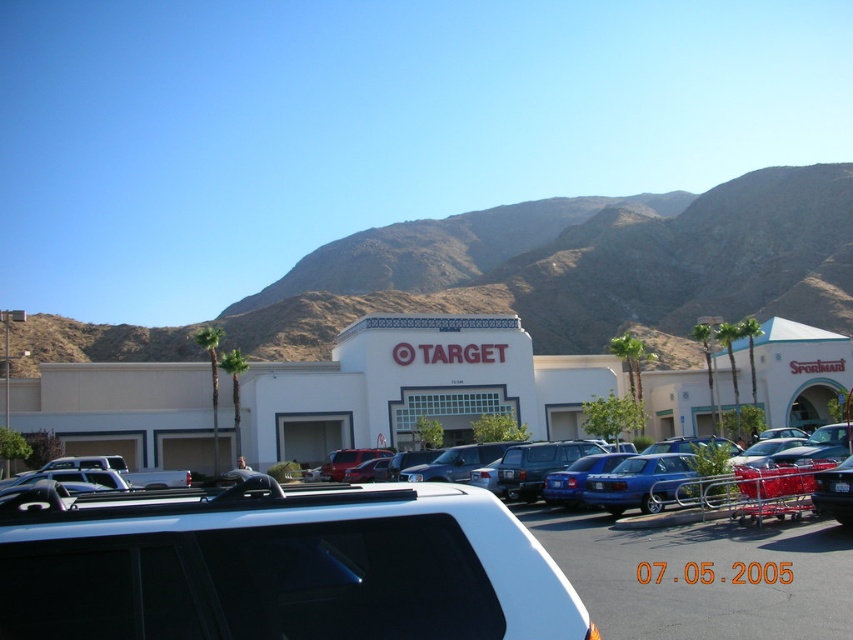
Looking at this image, between white plastic car at center and blue metallic sedan at center, which one appears on the right side from the viewer's perspective?

Positioned to the right is blue metallic sedan at center.

In the scene shown: Is white plastic car at center taller than blue metallic sedan at center?

Correct, white plastic car at center is much taller as blue metallic sedan at center.

Which is in front, point (16, 513) or point (552, 484)?

Point (16, 513)

This screenshot has width=853, height=640. Identify the location of white plastic car at center. (281, 566).

Is brown rocky mountain at upper center shorter than blue metallic sedan at center?

In fact, brown rocky mountain at upper center may be taller than blue metallic sedan at center.

Which is in front, point (740, 211) or point (566, 483)?

Positioned in front is point (566, 483).

Is point (786, 228) closer to camera compared to point (755, 467)?

No, (786, 228) is behind (755, 467).

This screenshot has width=853, height=640. Identify the location of brown rocky mountain at upper center. (625, 273).

Is white plastic car at center to the left of brown rocky mountain at upper center from the viewer's perspective?

Correct, you'll find white plastic car at center to the left of brown rocky mountain at upper center.

Where is `white plastic car at center`? This screenshot has width=853, height=640. white plastic car at center is located at coordinates (281, 566).

Is point (84, 627) less distant than point (33, 356)?

Yes, it is in front of point (33, 356).

This screenshot has width=853, height=640. I want to click on white plastic car at center, so click(281, 566).